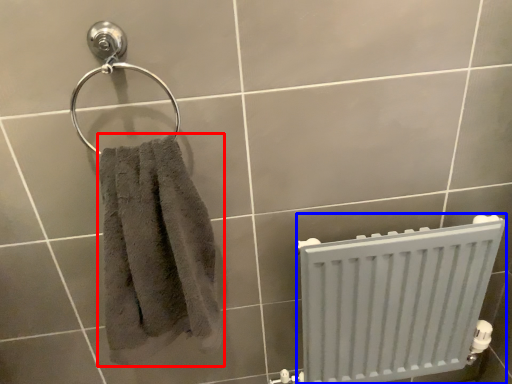
Question: Which point is closer to the camera, towel (highlighted by a red box) or radiator (highlighted by a blue box)?

Choices:
 (A) towel
 (B) radiator

Answer: (A)